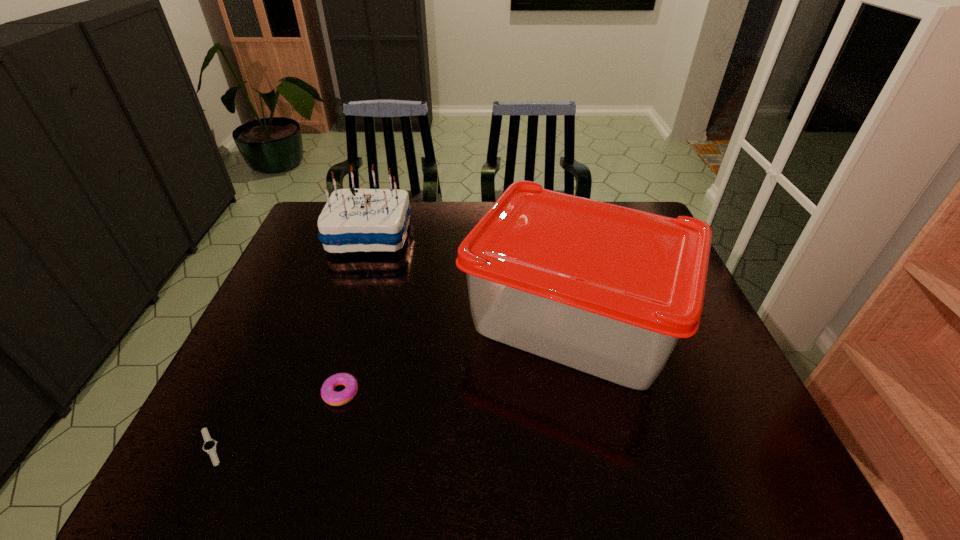
The height and width of the screenshot is (540, 960). I want to click on vacant space at the far right corner of the desktop, so click(x=643, y=206).

I want to click on free space at the near right corner of the desktop, so click(704, 464).

Locate an element on the screen. The width and height of the screenshot is (960, 540). free space between the tallest object and the doughnut is located at coordinates (457, 356).

Image resolution: width=960 pixels, height=540 pixels. I want to click on free spot between the third tallest object and the tray, so click(x=457, y=356).

In order to click on empty location between the leftmost object and the rightmost object in this screenshot , I will do `click(392, 383)`.

Where is `empty space between the nearest object and the tray`? The height and width of the screenshot is (540, 960). empty space between the nearest object and the tray is located at coordinates (392, 383).

Where is `vacant area between the tallest object and the second shortest object`? This screenshot has width=960, height=540. vacant area between the tallest object and the second shortest object is located at coordinates (457, 356).

Image resolution: width=960 pixels, height=540 pixels. What are the coordinates of `free spot between the watch and the tallest object` in the screenshot? It's located at (392, 383).

Find the location of a particular element. Image resolution: width=960 pixels, height=540 pixels. empty space that is in between the nearest object and the second tallest object is located at coordinates (290, 341).

Where is `vacant space that is in between the leftmost object and the rightmost object`? vacant space that is in between the leftmost object and the rightmost object is located at coordinates (392, 383).